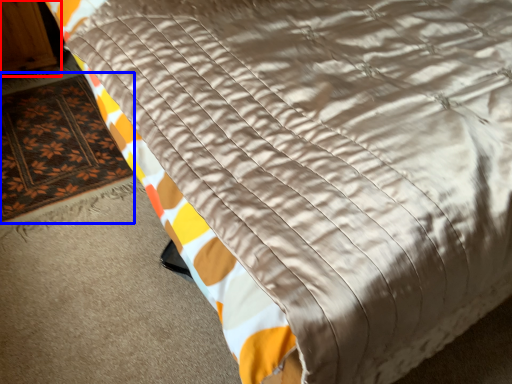
Question: Which of the following is the farthest to the observer, armoire (highlighted by a red box) or mat (highlighted by a blue box)?

Choices:
 (A) armoire
 (B) mat

Answer: (A)